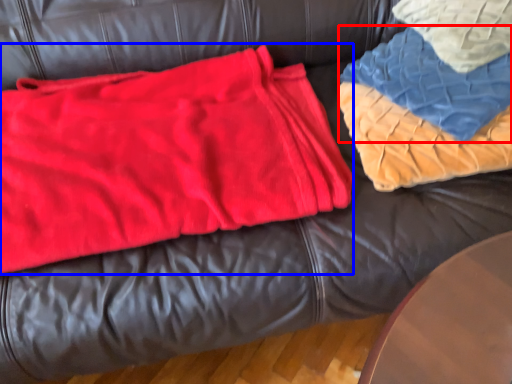
Question: Which point is further to the camera, blanket (highlighted by a red box) or bean bag chair (highlighted by a blue box)?

Choices:
 (A) blanket
 (B) bean bag chair

Answer: (A)